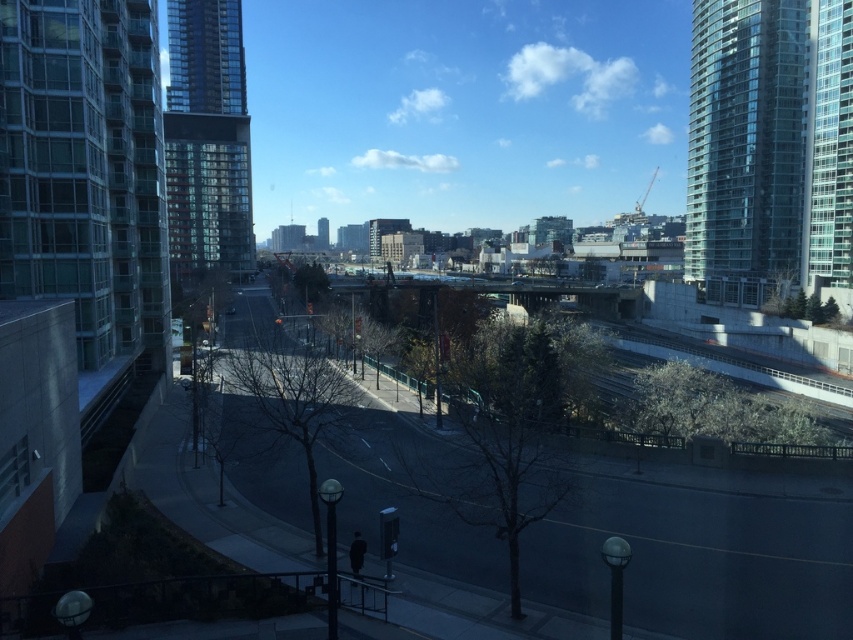
Question: Which point is closer to the camera?

Choices:
 (A) pos(24,186)
 (B) pos(828,58)
 (C) pos(190,45)
 (D) pos(322,248)

Answer: (A)

Question: Is glassy reflective building at left below glassy skyscraper at center?

Choices:
 (A) yes
 (B) no

Answer: (A)

Question: Is glassy reflective skyscraper at left wider than glassy skyscraper at center?

Choices:
 (A) no
 (B) yes

Answer: (B)

Question: Is glassy reflective skyscraper at right wider than glassy skyscraper at center?

Choices:
 (A) yes
 (B) no

Answer: (A)

Question: Which of the following is the closest to the observer?

Choices:
 (A) (132, 256)
 (B) (328, 241)
 (C) (747, 51)
 (D) (218, 234)

Answer: (A)

Question: Considering the real-world distances, which object is farthest from the glassy reflective skyscraper at left?

Choices:
 (A) glassy reflective skyscraper at right
 (B) glassy reflective building at left
 (C) glassy skyscraper at center

Answer: (C)